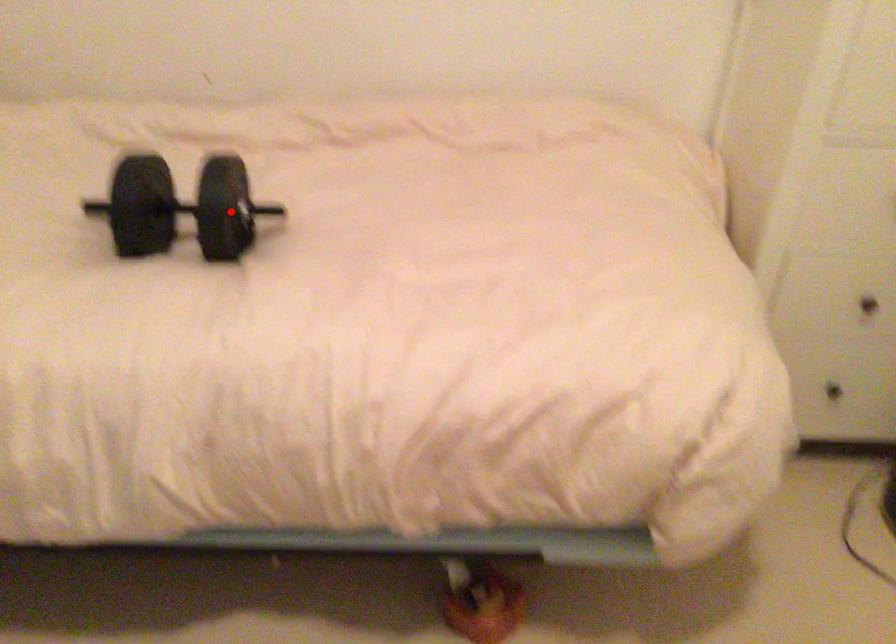
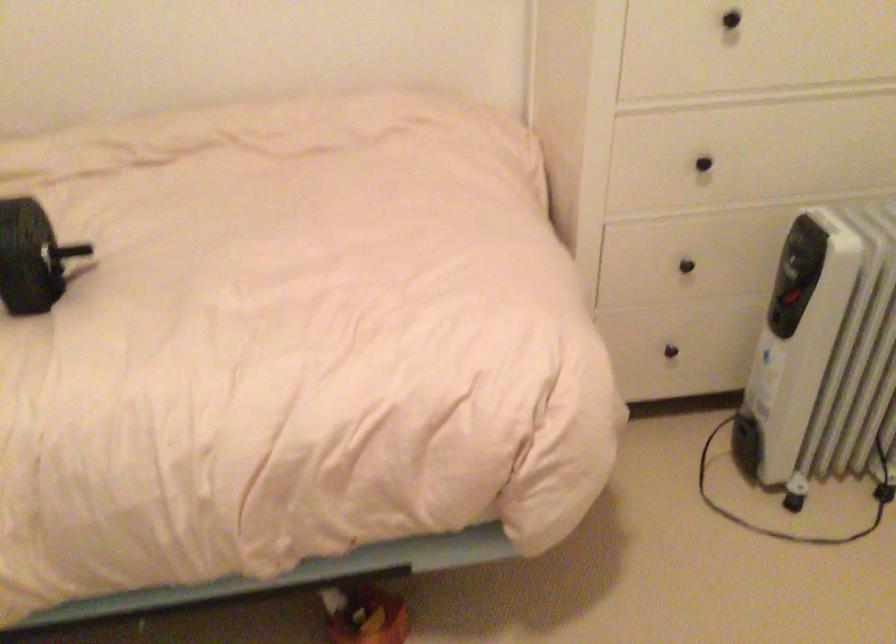
The point at the highlighted location is marked in the first image. Where is the corresponding point in the second image?

(30, 257)